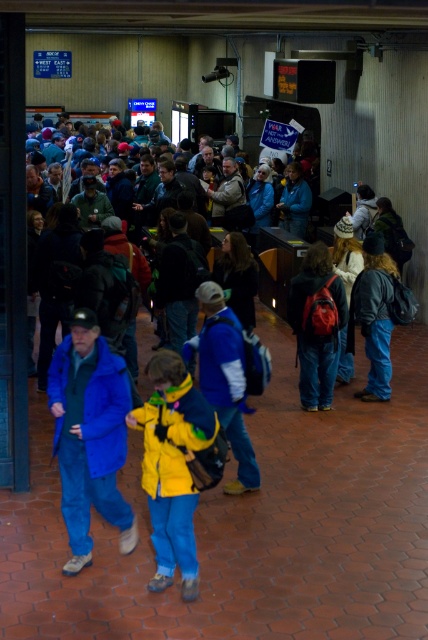
Question: Which point appears farthest from the camera in this image?

Choices:
 (A) (165, 448)
 (B) (306, 280)

Answer: (B)

Question: Does blue denim jacket at center come in front of blue fabric jacket at center?

Choices:
 (A) no
 (B) yes

Answer: (B)

Question: Considering the relative positions of blue denim jacket at center and denim jacket at right in the image provided, where is blue denim jacket at center located with respect to denim jacket at right?

Choices:
 (A) right
 (B) left

Answer: (B)

Question: Which object is closer to the camera taking this photo?

Choices:
 (A) blue fabric jacket at center
 (B) blue denim jacket at center
 (C) denim jacket at right

Answer: (B)

Question: Based on their relative distances, which object is farther from the matte red backpack at center?

Choices:
 (A) yellow matte jacket at center
 (B) blue denim jacket at center
 (C) blue fabric jacket at center
 (D) denim jacket at right

Answer: (B)

Question: Where is yellow matte jacket at center located in relation to matte red backpack at center in the image?

Choices:
 (A) right
 (B) left

Answer: (B)